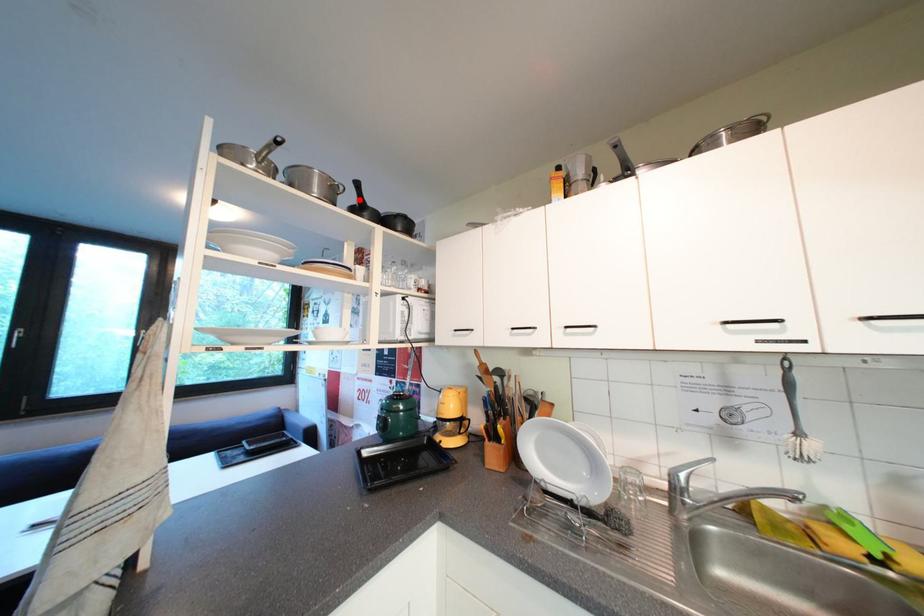
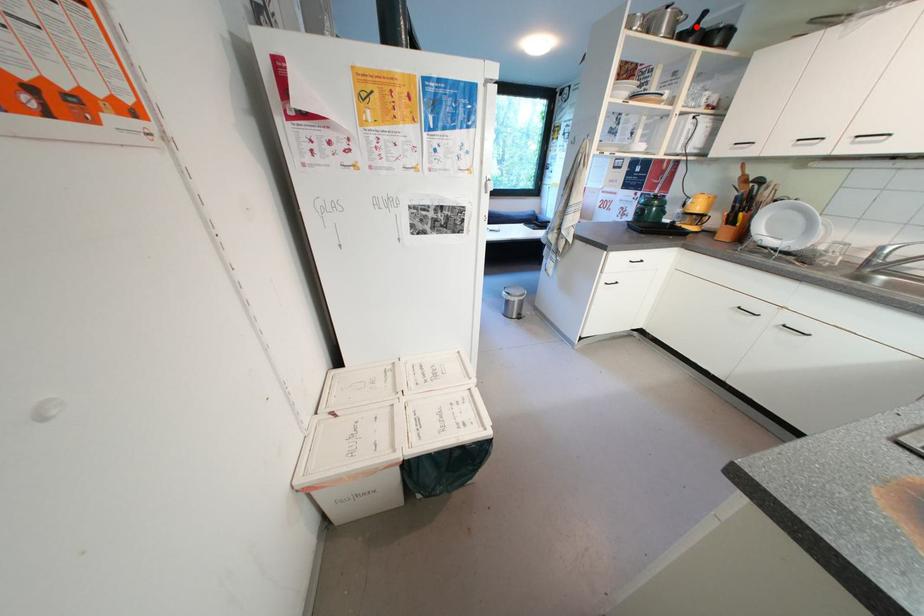
I am providing you with two images of the same scene from different viewpoints. A red point is marked on the first image and another point is marked on the second image. Are the points marked in image1 and image2 representing the same 3D position?

Yes